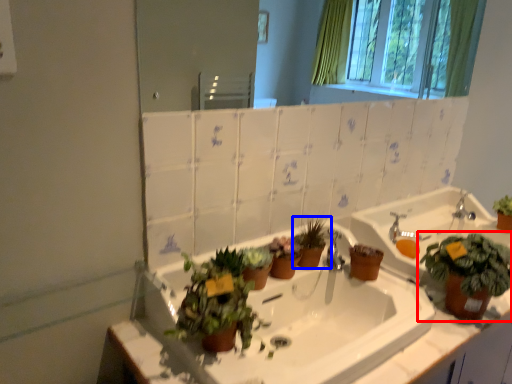
Question: Among these objects, which one is nearest to the camera, houseplant (highlighted by a red box) or houseplant (highlighted by a blue box)?

Choices:
 (A) houseplant
 (B) houseplant

Answer: (A)